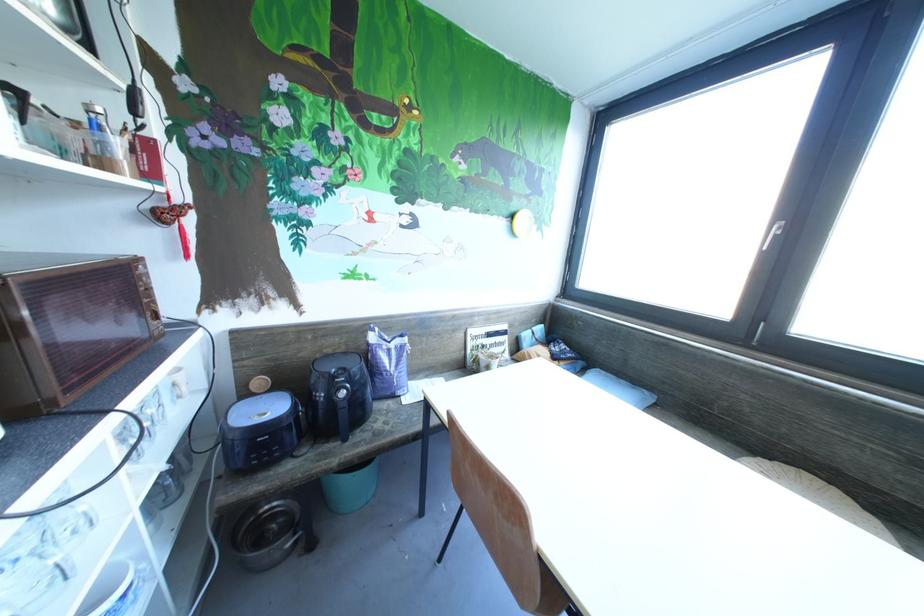
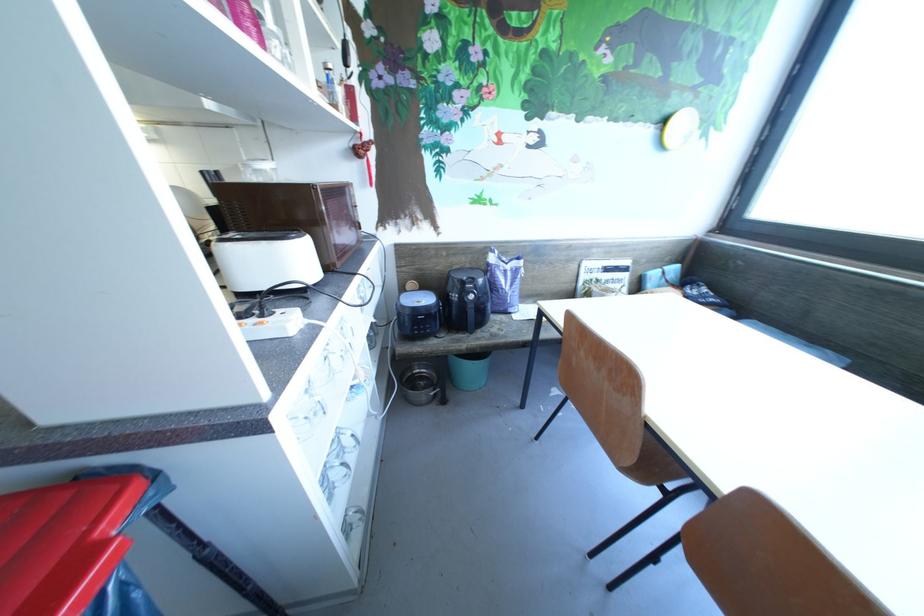
Question: The camera is either moving clockwise (left) or counter-clockwise (right) around the object. The first image is from the beginning of the video and the second image is from the end. Is the camera moving left or right when shooting the video?

Choices:
 (A) Left
 (B) Right

Answer: (B)